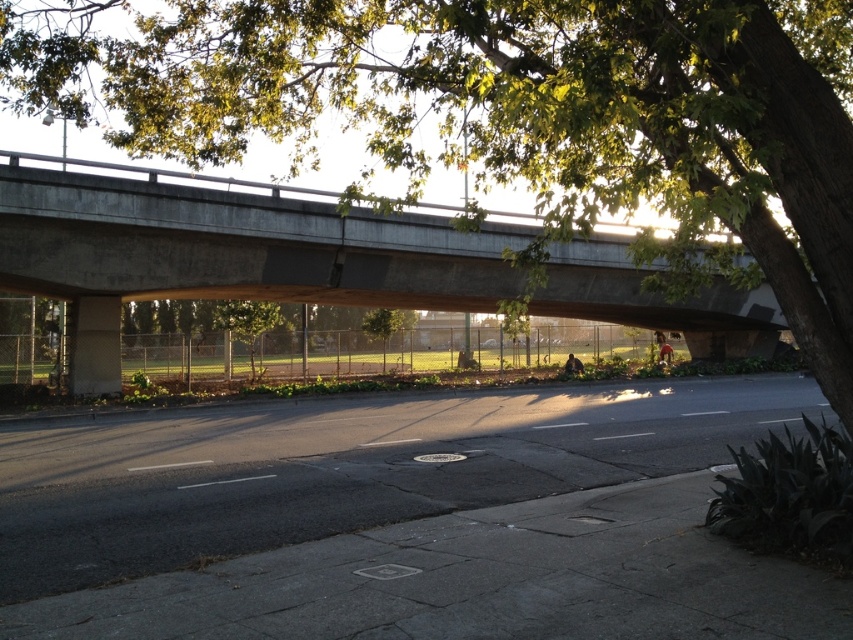
You are a city planner analyzing the image. Which structure takes up more visual area in the image, the black asphalt highway at center or the concrete bridge at upper center?

The concrete bridge at upper center occupies more visual area than the black asphalt highway at center according to the description.

You are a city planner assessing the urban space in the image. You need to determine if the green leafy tree at upper center can be moved closer to the concrete bridge at upper center without blocking the bridge. Based on their widths, what would you advise?

The green leafy tree at upper center has a lesser width compared to the concrete bridge at upper center. Since the tree is narrower, moving it closer might not block the bridge, but ensure there is enough space between them to maintain visibility and structural safety.